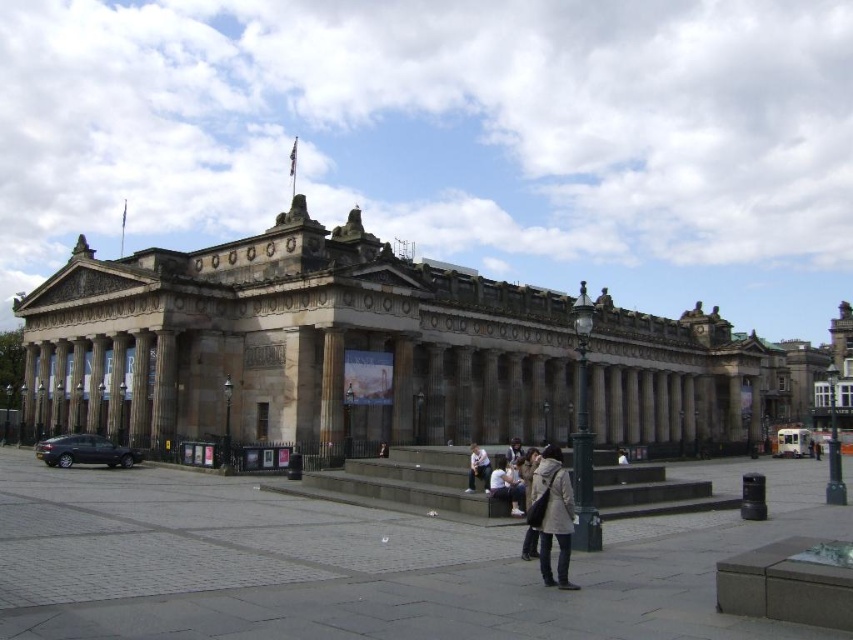
Based on the photo, you are standing in the plaza in front of the grand neoclassical building. You want to place a new bench between the smooth stone column at center and the dark gray coat at center. Which object should the bench be closer to to ensure it is placed between them?

The bench should be placed closer to the dark gray coat at center because the smooth stone column at center is closer to the viewer. To be between them, the bench must be nearer to the farther object, which is the dark gray coat at center.